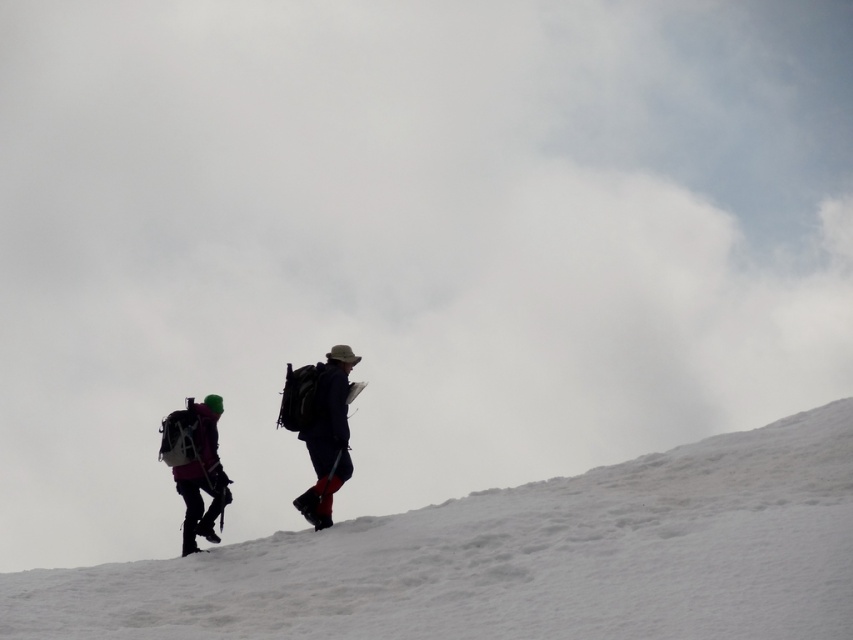
You are a hiker who needs to decide which item to prioritize packing based on visibility in the snowy terrain. Given that the matte pink jacket at center and the dark blue fabric backpack at center are both visible in the scene, which item would be more noticeable to someone searching for you?

The matte pink jacket at center is larger in size than the dark blue fabric backpack at center, so the matte pink jacket at center would be more noticeable due to its larger size standing out against the snowy background.

You are a hiker trying to navigate the snowy terrain. You notice the white powdery snow at center and the matte pink jacket at left. Which object is closer to the ground?

The white powdery snow at center is below the matte pink jacket at left, so it is closer to the ground.